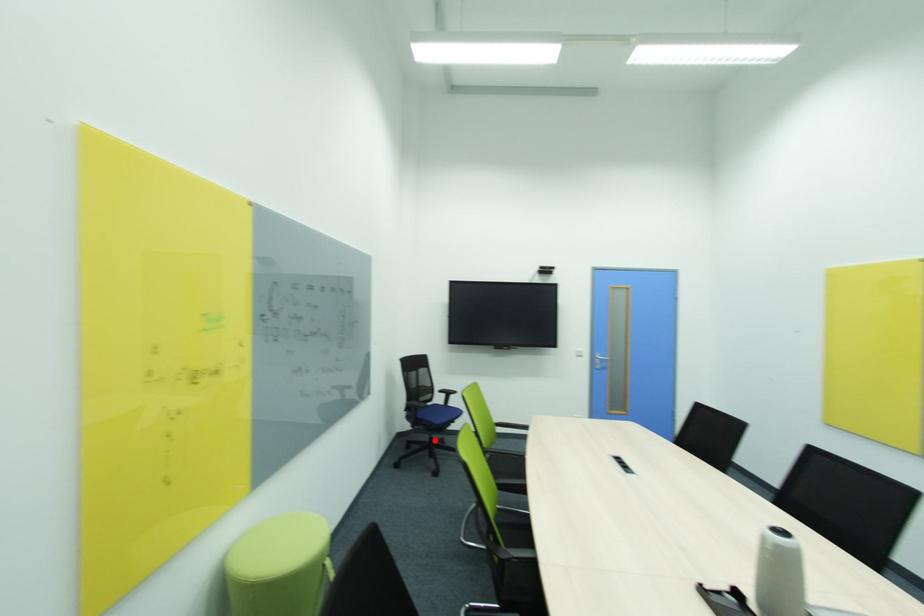
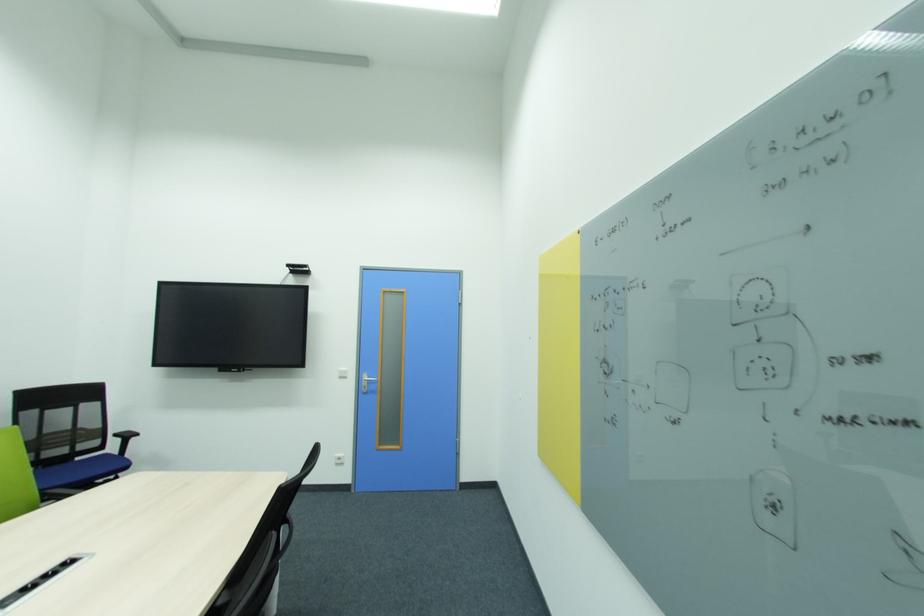
Question: I am providing you with two images of the same scene from different viewpoints. A red point is marked on the first image. Can you still see the location of the red point in image 2?

Choices:
 (A) Yes
 (B) No

Answer: (B)